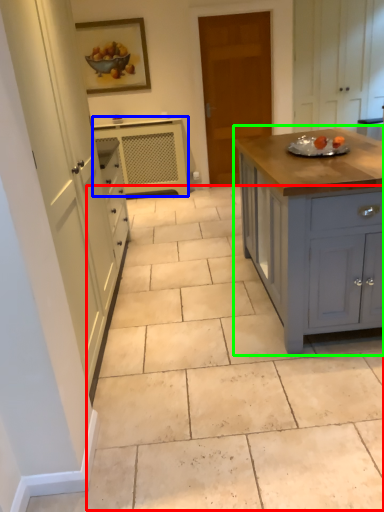
Question: Which is nearer to the path (highlighted by a red box)? cabinetry (highlighted by a blue box) or cabinetry (highlighted by a green box).

Choices:
 (A) cabinetry
 (B) cabinetry

Answer: (B)